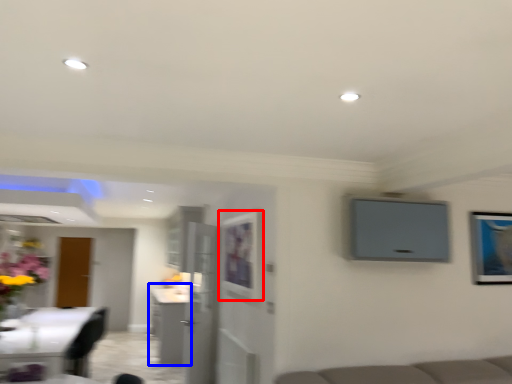
Question: Which object appears farthest to the camera in this image, picture frame (highlighted by a red box) or cabinetry (highlighted by a blue box)?

Choices:
 (A) picture frame
 (B) cabinetry

Answer: (B)